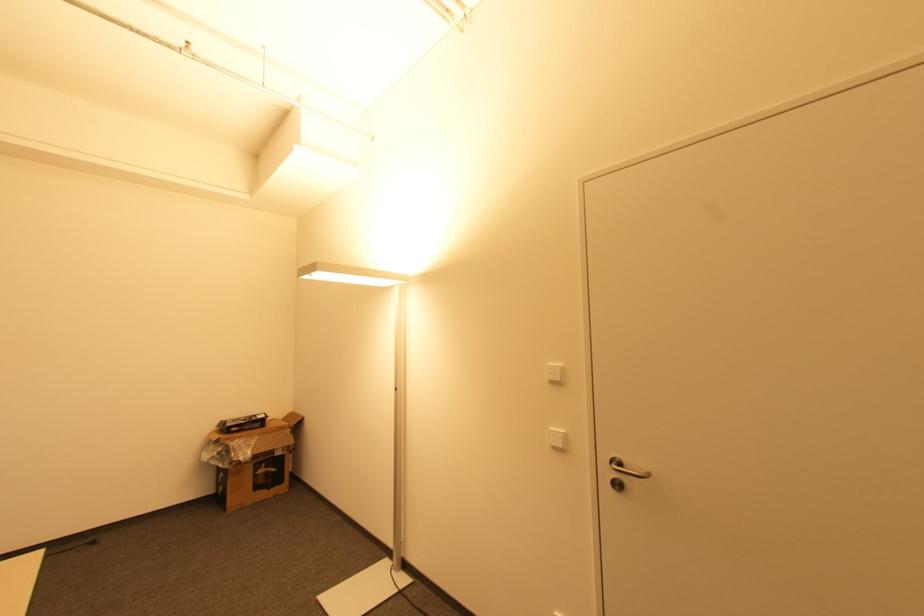
The image size is (924, 616). I want to click on silver door handle, so click(x=626, y=469).